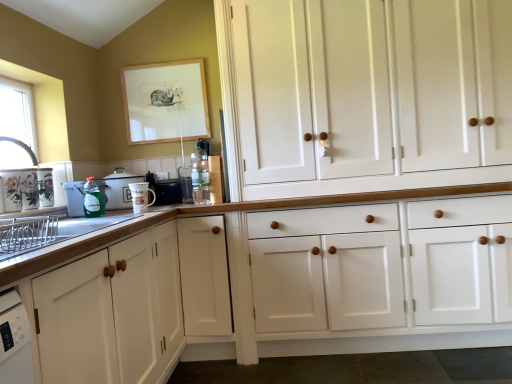
Describe the element at coordinates (365, 94) in the screenshot. The height and width of the screenshot is (384, 512). I see `white wood cabinets at center, placed as the first cabinetry when sorted from right to left` at that location.

Identify the location of wooden picture frame at upper center. The image size is (512, 384). (165, 102).

Describe the element at coordinates (48, 231) in the screenshot. The width and height of the screenshot is (512, 384). I see `satin silver dish rack at left` at that location.

How much space does white glossy mug at center, arranged as the 3th appliance when viewed from the right, occupy horizontally?

white glossy mug at center, arranged as the 3th appliance when viewed from the right, is 5.25 inches wide.

Describe the element at coordinates (141, 197) in the screenshot. I see `white glossy mug at center, arranged as the 3th appliance when viewed from the right` at that location.

The width and height of the screenshot is (512, 384). Identify the location of white wood cabinets at center, placed as the first cabinetry when sorted from right to left. tap(365, 94).

Locate an element on the screen. the 6th appliance in front when counting from the wooden picture frame at upper center is located at coordinates (26, 188).

Looking at this image, which is nearer, (10, 210) or (161, 68)?

The point (10, 210) is closer to the camera.

From the image's perspective, which is below, porcelain floral mugs at left, the sixth appliance in the right-to-left sequence, or wooden picture frame at upper center?

A: porcelain floral mugs at left, the sixth appliance in the right-to-left sequence, is shown below in the image.

Considering the relative sizes of porcelain floral mugs at left, placed as the 1th appliance when sorted from left to right, and wooden picture frame at upper center in the image provided, is porcelain floral mugs at left, placed as the 1th appliance when sorted from left to right, thinner than wooden picture frame at upper center?

Incorrect, the width of porcelain floral mugs at left, placed as the 1th appliance when sorted from left to right, is not less than that of wooden picture frame at upper center.

From a real-world perspective, which object rests below the other?

From a 3D spatial view, white glossy cabinet at lower left, which ranks as the 1th cabinetry in left-to-right order, is below.

In order to click on picture frame behind the white glossy cabinet at lower left, which ranks as the second cabinetry in right-to-left order in this screenshot , I will do `click(165, 102)`.

Considering the positions of objects wooden picture frame at upper center and white glossy cabinet at lower left, which ranks as the 1th cabinetry in left-to-right order, in the image provided, who is more to the right, wooden picture frame at upper center or white glossy cabinet at lower left, which ranks as the 1th cabinetry in left-to-right order,?

From the viewer's perspective, wooden picture frame at upper center appears more on the right side.

Is wooden picture frame at upper center bigger than white glossy cabinet at lower left, which ranks as the second cabinetry in right-to-left order?

No.

From a real-world perspective, which object stands above the other?

black plastic toaster at center, which is the second appliance in right-to-left order, is physically above.

Between black plastic toaster at center, the fifth appliance viewed from the left, and white glossy cabinet at lower left, which ranks as the second cabinetry in right-to-left order, which one has larger width?

With larger width is white glossy cabinet at lower left, which ranks as the second cabinetry in right-to-left order.

Considering the positions of point (170, 182) and point (69, 274), is point (170, 182) closer or farther from the camera than point (69, 274)?

Point (170, 182) is positioned farther from the camera compared to point (69, 274).

Is black plastic toaster at center, which is the second appliance in right-to-left order, facing away from white glossy cabinet at lower left, which ranks as the second cabinetry in right-to-left order?

No.

Are green glass bottle at left, the 1th bottle viewed from the front, and green plastic bottle at left, which appears as the fourth appliance when viewed from the right, far apart?

No, green glass bottle at left, the 1th bottle viewed from the front, is not far away from green plastic bottle at left, which appears as the fourth appliance when viewed from the right.

Considering the positions of objects green glass bottle at left, which appears as the 2th bottle when viewed from the back, and green plastic bottle at left, the 3th appliance when ordered from left to right, in the image provided, who is more to the left, green glass bottle at left, which appears as the 2th bottle when viewed from the back, or green plastic bottle at left, the 3th appliance when ordered from left to right,?

From the viewer's perspective, green plastic bottle at left, the 3th appliance when ordered from left to right, appears more on the left side.

Do you think green glass bottle at left, which appears as the 2th bottle when viewed from the back, is within green plastic bottle at left, which appears as the fourth appliance when viewed from the right, or outside of it?

green glass bottle at left, which appears as the 2th bottle when viewed from the back, lies outside green plastic bottle at left, which appears as the fourth appliance when viewed from the right.

Is green plastic dish soap at left, which is the 2th appliance from left to right, looking in the opposite direction of translucent glass bottle at center, positioned as the second bottle in left-to-right order?

No, translucent glass bottle at center, positioned as the second bottle in left-to-right order, is not at the back of green plastic dish soap at left, which is the 2th appliance from left to right.

Between green plastic dish soap at left, acting as the 5th appliance starting from the right, and translucent glass bottle at center, the first bottle from the back, which one is positioned in front?

Positioned in front is green plastic dish soap at left, acting as the 5th appliance starting from the right.

Consider the image. Considering the positions of objects green plastic dish soap at left, which is the 2th appliance from left to right, and translucent glass bottle at center, positioned as the 1th bottle in right-to-left order, in the image provided, who is more to the left, green plastic dish soap at left, which is the 2th appliance from left to right, or translucent glass bottle at center, positioned as the 1th bottle in right-to-left order,?

green plastic dish soap at left, which is the 2th appliance from left to right.

Which is nearer, (78, 281) or (191, 198)?

Point (78, 281) is positioned closer to the camera compared to point (191, 198).

From a real-world perspective, does white glossy cabinet at lower left, which ranks as the 1th cabinetry in left-to-right order, sit lower than metallic silver toaster at upper center, positioned as the 6th appliance in left-to-right order?

Correct, in the physical world, white glossy cabinet at lower left, which ranks as the 1th cabinetry in left-to-right order, is lower than metallic silver toaster at upper center, positioned as the 6th appliance in left-to-right order.

In order to click on the 2nd cabinetry in front of the metallic silver toaster at upper center, positioned as the 6th appliance in left-to-right order in this screenshot , I will do `click(112, 312)`.

From the image's perspective, does white glossy cabinet at lower left, which ranks as the second cabinetry in right-to-left order, appear lower than metallic silver toaster at upper center, arranged as the first appliance when viewed from the right?

Correct, white glossy cabinet at lower left, which ranks as the second cabinetry in right-to-left order, appears lower than metallic silver toaster at upper center, arranged as the first appliance when viewed from the right, in the image.

The width and height of the screenshot is (512, 384). I want to click on the 3rd appliance located above the satin silver dish rack at left (from a real-world perspective), so click(x=75, y=198).

Looking at their sizes, would you say green plastic dish soap at left, which is the 2th appliance from left to right, is wider or thinner than satin silver dish rack at left?

Considering their sizes, green plastic dish soap at left, which is the 2th appliance from left to right, looks slimmer than satin silver dish rack at left.

From the image's perspective, is green plastic dish soap at left, acting as the 5th appliance starting from the right, positioned above or below satin silver dish rack at left?

green plastic dish soap at left, acting as the 5th appliance starting from the right, is above satin silver dish rack at left.

In the scene shown: Would you say green plastic dish soap at left, which is the 2th appliance from left to right, is inside or outside satin silver dish rack at left?

green plastic dish soap at left, which is the 2th appliance from left to right, cannot be found inside satin silver dish rack at left.

I want to click on the 1st appliance below the wooden picture frame at upper center (from a real-world perspective), so click(26, 188).

Which cabinetry is the 2nd one when counting from the front of the wooden picture frame at upper center? Please provide its 2D coordinates.

[(112, 312)]

Based on their spatial positions, is green glass bottle at left, the 1th bottle viewed from the front, or translucent glass bottle at center, arranged as the second bottle when viewed from the front, closer to white glossy mug at center, the 4th appliance when ordered from left to right?

green glass bottle at left, the 1th bottle viewed from the front, is positioned closer to the anchor white glossy mug at center, the 4th appliance when ordered from left to right.

Considering their positions, is porcelain floral mugs at left, placed as the 1th appliance when sorted from left to right, positioned closer to white wood cabinets at center, the 2th cabinetry from the left, than green plastic dish soap at left, acting as the 5th appliance starting from the right?

The object closer to white wood cabinets at center, the 2th cabinetry from the left, is green plastic dish soap at left, acting as the 5th appliance starting from the right.

Looking at the image, which one is located further to wooden picture frame at upper center, satin silver dish rack at left or black plastic toaster at center, the fifth appliance viewed from the left?

satin silver dish rack at left lies further to wooden picture frame at upper center than the other object.

Looking at the image, which one is located closer to white glossy mug at center, the 4th appliance when ordered from left to right, white wood cabinets at center, the 2th cabinetry from the left, or metallic silver toaster at upper center, arranged as the first appliance when viewed from the right?

metallic silver toaster at upper center, arranged as the first appliance when viewed from the right.

Which object lies nearer to the anchor point green glass bottle at left, which appears as the 2th bottle when viewed from the back, metallic silver toaster at upper center, arranged as the first appliance when viewed from the right, or porcelain floral mugs at left, the sixth appliance in the right-to-left sequence?

Based on the image, porcelain floral mugs at left, the sixth appliance in the right-to-left sequence, appears to be nearer to green glass bottle at left, which appears as the 2th bottle when viewed from the back.

Estimate the real-world distances between objects in this image. Which object is closer to porcelain floral mugs at left, the sixth appliance in the right-to-left sequence, green glass bottle at left, the second bottle viewed from the right, or metallic silver toaster at upper center, positioned as the 6th appliance in left-to-right order?

green glass bottle at left, the second bottle viewed from the right, is closer to porcelain floral mugs at left, the sixth appliance in the right-to-left sequence.

When comparing their distances from metallic silver toaster at upper center, positioned as the 6th appliance in left-to-right order, does translucent glass bottle at center, arranged as the second bottle when viewed from the front, or wooden picture frame at upper center seem further?

wooden picture frame at upper center is further to metallic silver toaster at upper center, positioned as the 6th appliance in left-to-right order.

Looking at this image, considering their positions, is green plastic bottle at left, the 3th appliance when ordered from left to right, positioned further to metallic silver toaster at upper center, positioned as the 6th appliance in left-to-right order, than translucent glass bottle at center, arranged as the second bottle when viewed from the front?

green plastic bottle at left, the 3th appliance when ordered from left to right, is positioned further to the anchor metallic silver toaster at upper center, positioned as the 6th appliance in left-to-right order.

Image resolution: width=512 pixels, height=384 pixels. Find the location of `bottle between green glass bottle at left, the 1th bottle viewed from the front, and white wood cabinets at center, placed as the first cabinetry when sorted from right to left, from left to right`. bottle between green glass bottle at left, the 1th bottle viewed from the front, and white wood cabinets at center, placed as the first cabinetry when sorted from right to left, from left to right is located at coordinates (200, 175).

The image size is (512, 384). In order to click on cabinetry between porcelain floral mugs at left, placed as the 1th appliance when sorted from left to right, and white wood cabinets at center, placed as the first cabinetry when sorted from right to left, from left to right in this screenshot , I will do `click(112, 312)`.

Where is `picture frame situated between porcelain floral mugs at left, the sixth appliance in the right-to-left sequence, and metallic silver toaster at upper center, positioned as the 6th appliance in left-to-right order, from left to right`? Image resolution: width=512 pixels, height=384 pixels. picture frame situated between porcelain floral mugs at left, the sixth appliance in the right-to-left sequence, and metallic silver toaster at upper center, positioned as the 6th appliance in left-to-right order, from left to right is located at coordinates (165, 102).

I want to click on bottle between white glossy cabinet at lower left, which ranks as the 1th cabinetry in left-to-right order, and white glossy mug at center, arranged as the 3th appliance when viewed from the right, from front to back, so 92,199.